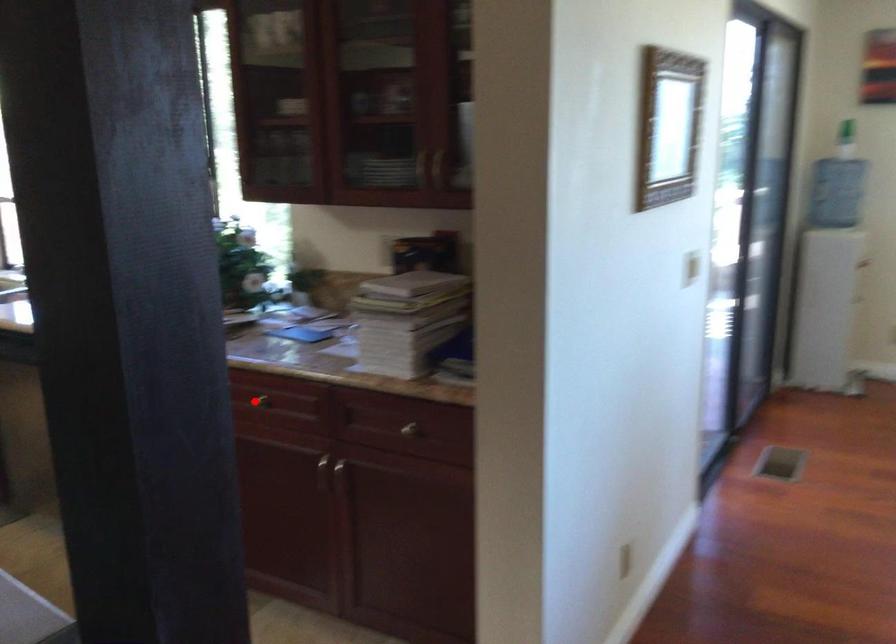
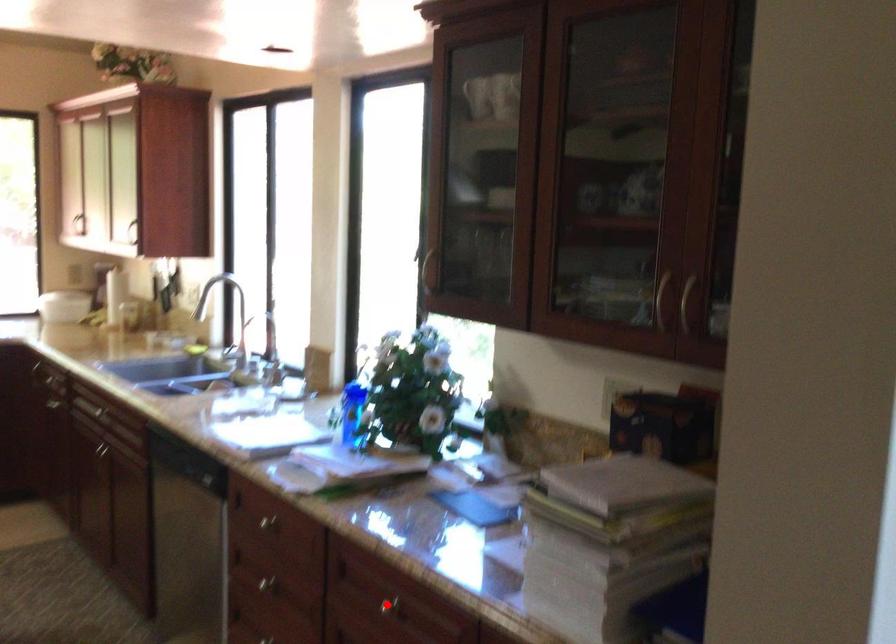
Based on the photo, I am providing you with two images of the same scene from different viewpoints. A red point is marked on the first image and another point is marked on the second image. Is the red point in image1 aligned with the point shown in image2?

Yes